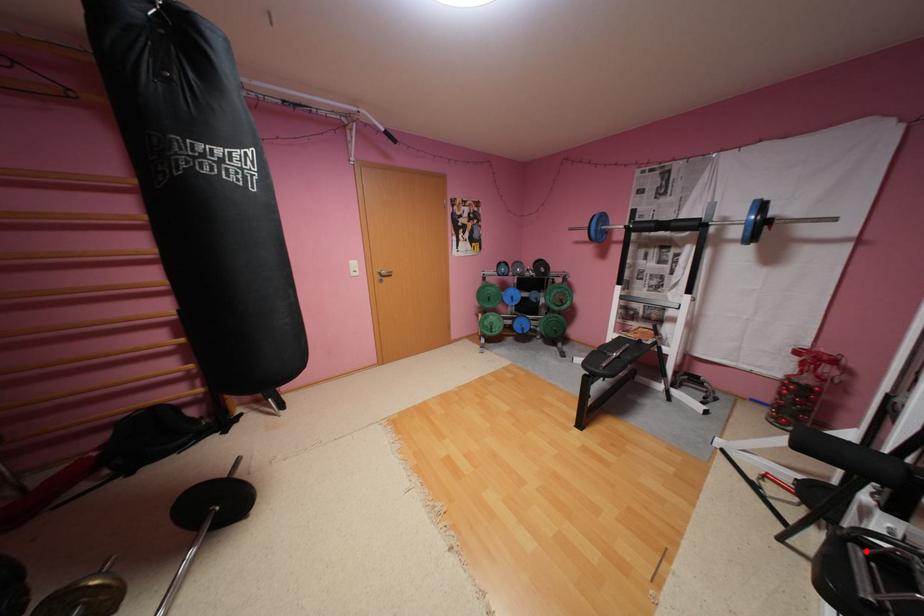
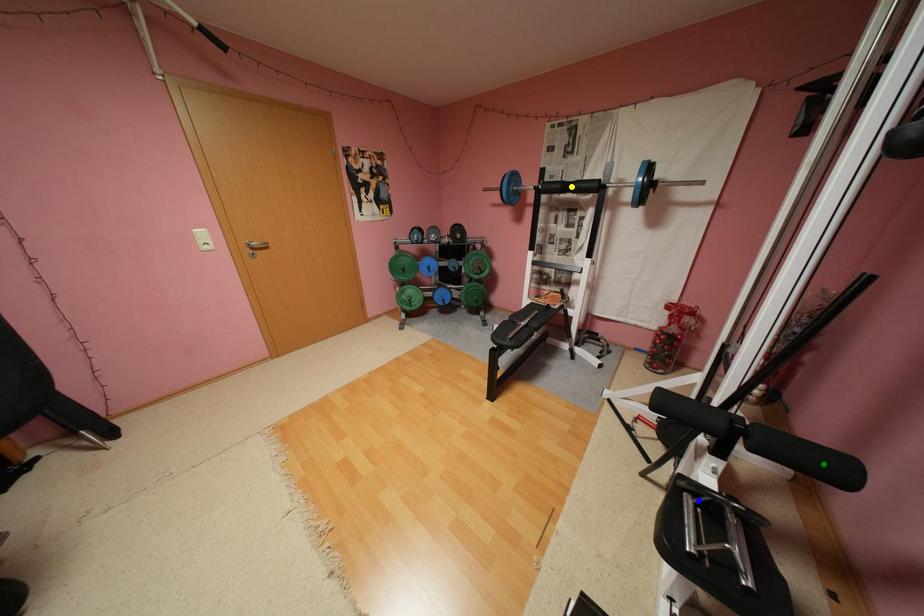
Question: I am providing you with two images of the same scene from different viewpoints. A red point is marked on the first image. You are given multiple points on the second image. Which point in image 2 represents the same 3d spot as the red point in image 1?

Choices:
 (A) blue point
 (B) green point
 (C) yellow point

Answer: (A)